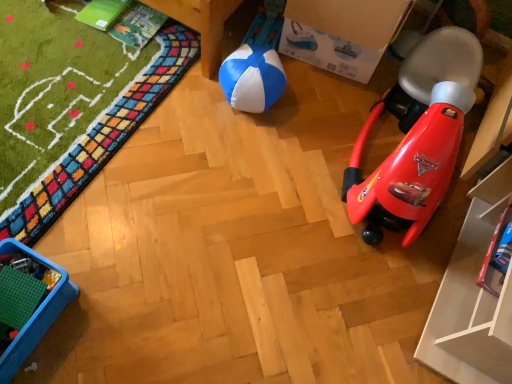
Question: Considering the relative positions of blue/white fabric ball at center and red plastic rocket at right, arranged as the second toy when ordered from the bottom, in the image provided, is blue/white fabric ball at center to the right of red plastic rocket at right, arranged as the second toy when ordered from the bottom, from the viewer's perspective?

Choices:
 (A) no
 (B) yes

Answer: (A)

Question: Is blue/white fabric ball at center wider than red plastic rocket at right, arranged as the second toy when ordered from the bottom?

Choices:
 (A) no
 (B) yes

Answer: (A)

Question: Is red plastic rocket at right, positioned as the 1th toy in top-to-bottom order, surrounded by blue/white fabric ball at center?

Choices:
 (A) no
 (B) yes

Answer: (A)

Question: Is blue/white fabric ball at center bigger than red plastic rocket at right, arranged as the second toy when ordered from the bottom?

Choices:
 (A) no
 (B) yes

Answer: (A)

Question: Considering the relative sizes of blue/white fabric ball at center and red plastic rocket at right, arranged as the second toy when ordered from the bottom, in the image provided, is blue/white fabric ball at center smaller than red plastic rocket at right, arranged as the second toy when ordered from the bottom,?

Choices:
 (A) no
 (B) yes

Answer: (B)

Question: Looking at their shapes, would you say metallic blue toy car at lower right, which is counted as the 1th toy, starting from the bottom, is wider or thinner than blue plastic tray at lower left?

Choices:
 (A) wide
 (B) thin

Answer: (B)

Question: Based on their sizes in the image, would you say metallic blue toy car at lower right, which is counted as the 1th toy, starting from the bottom, is bigger or smaller than blue plastic tray at lower left?

Choices:
 (A) big
 (B) small

Answer: (B)

Question: From the image's perspective, relative to blue plastic tray at lower left, is metallic blue toy car at lower right, the second toy from the top, above or below?

Choices:
 (A) above
 (B) below

Answer: (A)

Question: Based on their positions, is metallic blue toy car at lower right, which is counted as the 1th toy, starting from the bottom, located to the left or right of blue plastic tray at lower left?

Choices:
 (A) right
 (B) left

Answer: (A)

Question: From the image's perspective, relative to cardboard box at upper center, is metallic blue toy car at lower right, the second toy from the top, above or below?

Choices:
 (A) below
 (B) above

Answer: (A)

Question: From a real-world perspective, is metallic blue toy car at lower right, the second toy from the top, positioned above or below cardboard box at upper center?

Choices:
 (A) below
 (B) above

Answer: (A)

Question: Considering the positions of metallic blue toy car at lower right, which is counted as the 1th toy, starting from the bottom, and cardboard box at upper center in the image, is metallic blue toy car at lower right, which is counted as the 1th toy, starting from the bottom, wider or thinner than cardboard box at upper center?

Choices:
 (A) wide
 (B) thin

Answer: (B)

Question: In terms of height, does metallic blue toy car at lower right, the second toy from the top, look taller or shorter compared to cardboard box at upper center?

Choices:
 (A) tall
 (B) short

Answer: (B)

Question: In terms of height, does red plastic rocket at right, positioned as the 1th toy in top-to-bottom order, look taller or shorter compared to blue/white fabric ball at center?

Choices:
 (A) tall
 (B) short

Answer: (A)

Question: From a real-world perspective, is red plastic rocket at right, positioned as the 1th toy in top-to-bottom order, physically located above or below blue/white fabric ball at center?

Choices:
 (A) above
 (B) below

Answer: (A)